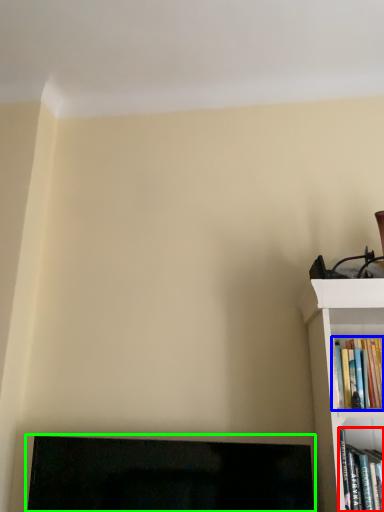
Question: Based on their relative distances, which object is farther from book (highlighted by a red box)? Choose from book (highlighted by a blue box) and fireplace (highlighted by a green box).

Choices:
 (A) book
 (B) fireplace

Answer: (B)